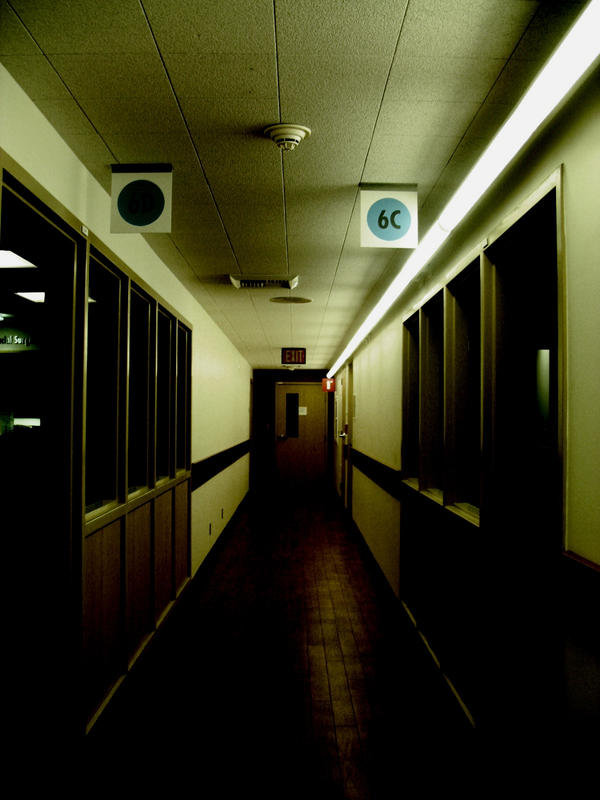
You are a GUI agent. You are given a task and a screenshot of the screen. Output one action in this format:
    pyautogui.click(x=<x>, y=<y>)
    Task: Click on the brown wallpaper
    Image resolution: width=600 pixels, height=800 pixels.
    Given the screenshot: What is the action you would take?
    pyautogui.click(x=366, y=470)